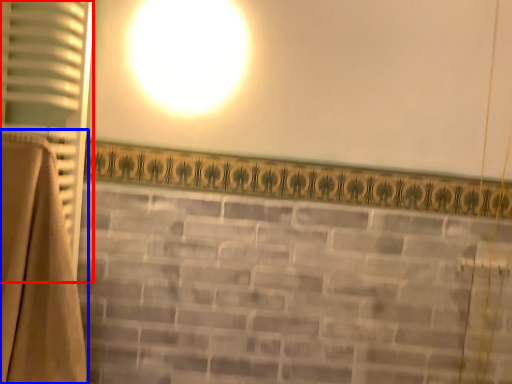
Question: Which of the following is the farthest to the observer, curtain (highlighted by a red box) or curtain (highlighted by a blue box)?

Choices:
 (A) curtain
 (B) curtain

Answer: (A)